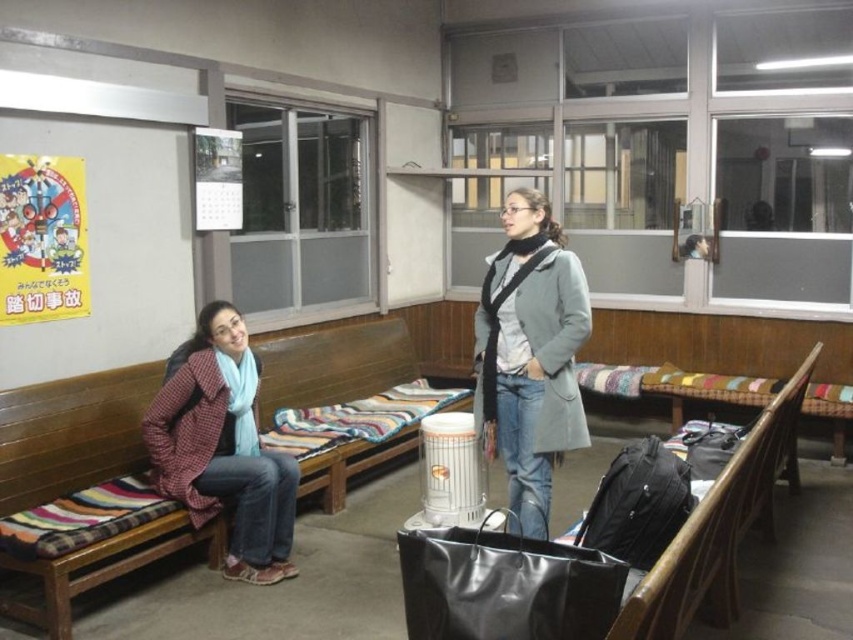
You are a traveler who wants to reach the exit door located behind the plaid woolen jacket at left. Can you walk directly towards the exit without moving around the gray wool coat at center?

The gray wool coat at center is in front of the plaid woolen jacket at left, so you cannot walk directly to the exit door behind the plaid woolen jacket at left without moving around the gray wool coat at center.

You are a traveler who just entered the waiting area and want to sit down. There is a wooden bench with striped cushion at left and a plaid woolen jacket at left. Which object should you approach to sit down?

The wooden bench with striped cushion at left is the correct object to approach for sitting. The plaid woolen jacket at left is an item of clothing worn by the seated woman and not a seating option.

You are a traveler carrying a suitcase that is 5 feet long. You want to place it between the wooden bench with striped cushion at left and the gray wool coat at center. Is there enough space?

The wooden bench with striped cushion at left is 4.73 feet away from the gray wool coat at center. Since the distance between them is less than the length of the suitcase, there is not enough space to place the 5 feet long suitcase between them.